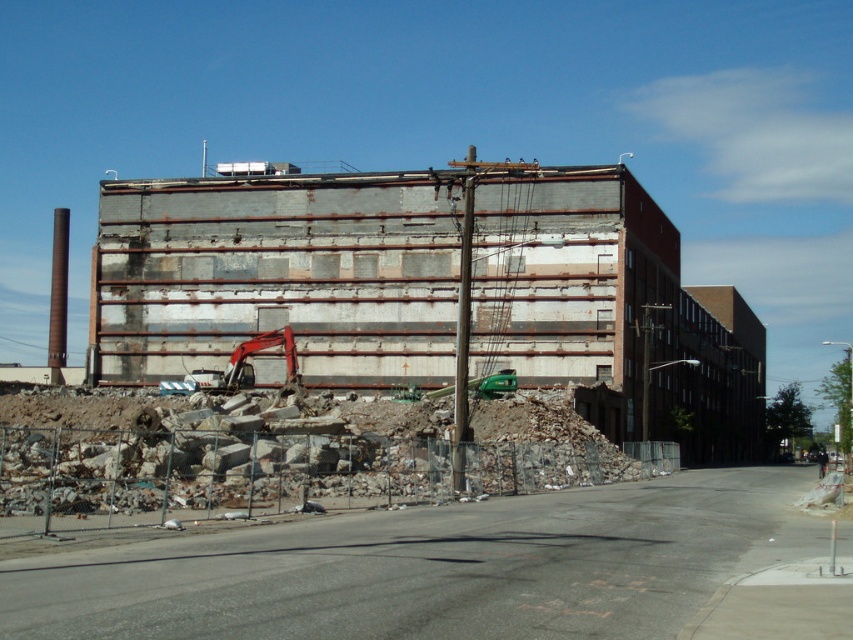
Question: Is rusty metal building at center smaller than orange metallic excavator at center?

Choices:
 (A) yes
 (B) no

Answer: (B)

Question: Does rusty metal building at center appear on the left side of orange metallic excavator at center?

Choices:
 (A) no
 (B) yes

Answer: (A)

Question: Which point is closer to the camera taking this photo?

Choices:
 (A) (247, 356)
 (B) (167, 212)

Answer: (A)

Question: Which point is closer to the camera taking this photo?

Choices:
 (A) (540, 384)
 (B) (299, 380)

Answer: (B)

Question: Can you confirm if rusty metal building at center is smaller than orange metallic excavator at center?

Choices:
 (A) no
 (B) yes

Answer: (A)

Question: Among these points, which one is nearest to the camera?

Choices:
 (A) (277, 218)
 (B) (245, 376)

Answer: (B)